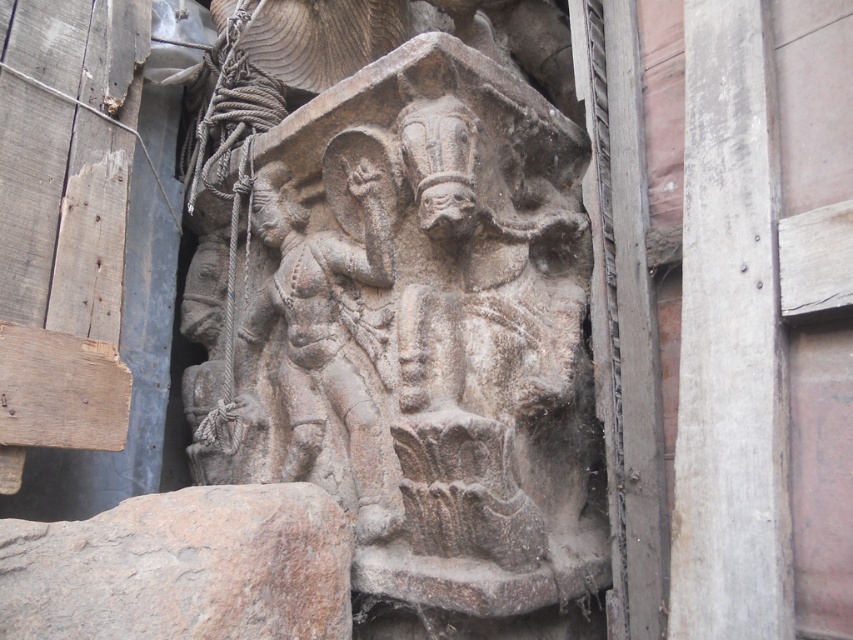
Question: Observing the image, what is the correct spatial positioning of smooth concrete pillar at right in reference to gray stone statue at center?

Choices:
 (A) above
 (B) below

Answer: (A)

Question: Which of the following is the farthest from the observer?

Choices:
 (A) smooth concrete pillar at right
 (B) gray stone carving at center

Answer: (B)

Question: Which is farther from the gray stone sculpture at center?

Choices:
 (A) gray stone carving at center
 (B) gray stone statue at center
 (C) smooth concrete pillar at right

Answer: (C)

Question: Is gray stone sculpture at center positioned at the back of gray stone carving at center?

Choices:
 (A) yes
 (B) no

Answer: (A)

Question: Which object is the farthest from the gray stone statue at center?

Choices:
 (A) smooth concrete pillar at right
 (B) gray stone sculpture at center

Answer: (A)

Question: Can you confirm if gray stone sculpture at center is bigger than gray stone carving at center?

Choices:
 (A) yes
 (B) no

Answer: (A)